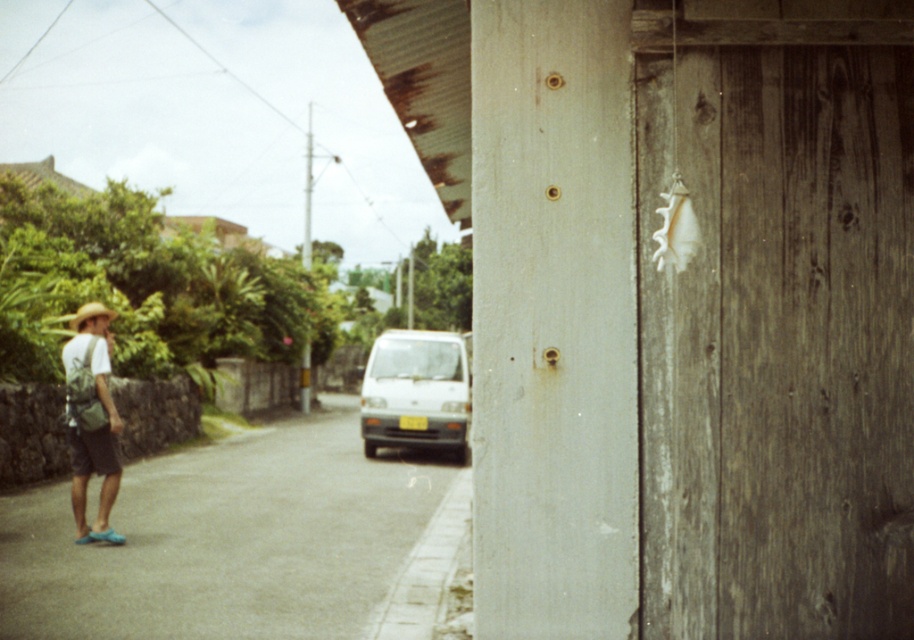
Is gray asphalt pavement at lower left closer to camera compared to white matte van at center?

Yes, gray asphalt pavement at lower left is in front of white matte van at center.

Consider the image. Can you confirm if gray asphalt pavement at lower left is positioned below white matte van at center?

Correct, gray asphalt pavement at lower left is located below white matte van at center.

Is point (123, 566) less distant than point (426, 374)?

That is True.

At what (x,y) coordinates should I click in order to perform the action: click on gray asphalt pavement at lower left. Please return your answer as a coordinate pair (x, y). Image resolution: width=914 pixels, height=640 pixels. Looking at the image, I should click on (226, 540).

Is gray asphalt pavement at lower left smaller than matte green backpack at left?

No.

Who is lower down, gray asphalt pavement at lower left or matte green backpack at left?

gray asphalt pavement at lower left

At what (x,y) coordinates should I click in order to perform the action: click on gray asphalt pavement at lower left. Please return your answer as a coordinate pair (x, y). Looking at the image, I should click on (226, 540).

Image resolution: width=914 pixels, height=640 pixels. I want to click on gray asphalt pavement at lower left, so click(x=226, y=540).

Does white matte van at center appear under matte green backpack at left?

Yes, white matte van at center is below matte green backpack at left.

Between white matte van at center and matte green backpack at left, which one has less height?

matte green backpack at left is shorter.

Image resolution: width=914 pixels, height=640 pixels. What do you see at coordinates (416, 392) in the screenshot? I see `white matte van at center` at bounding box center [416, 392].

Find the location of `white matte van at center`. white matte van at center is located at coordinates (416, 392).